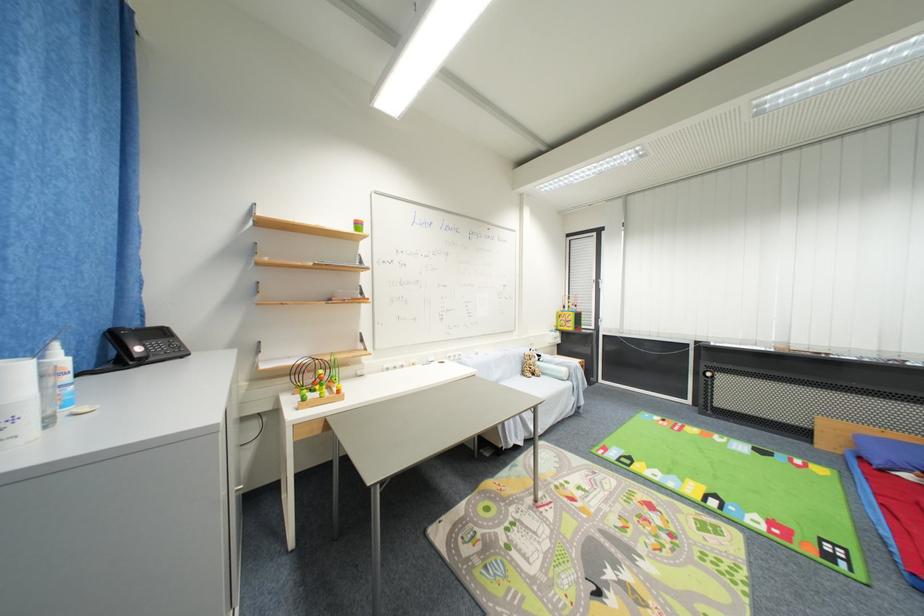
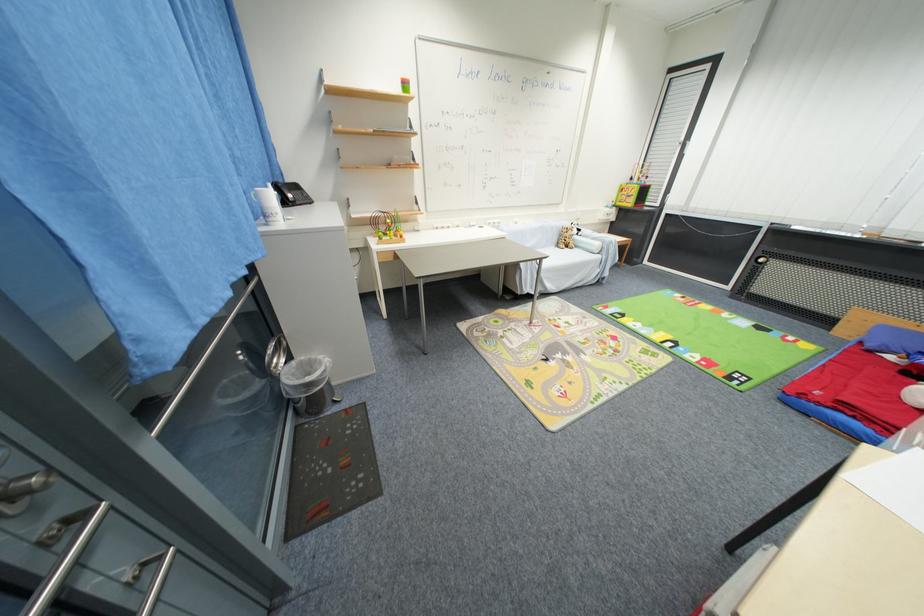
Where in the second image is the point corresponding to point (143, 351) from the first image?

(296, 198)